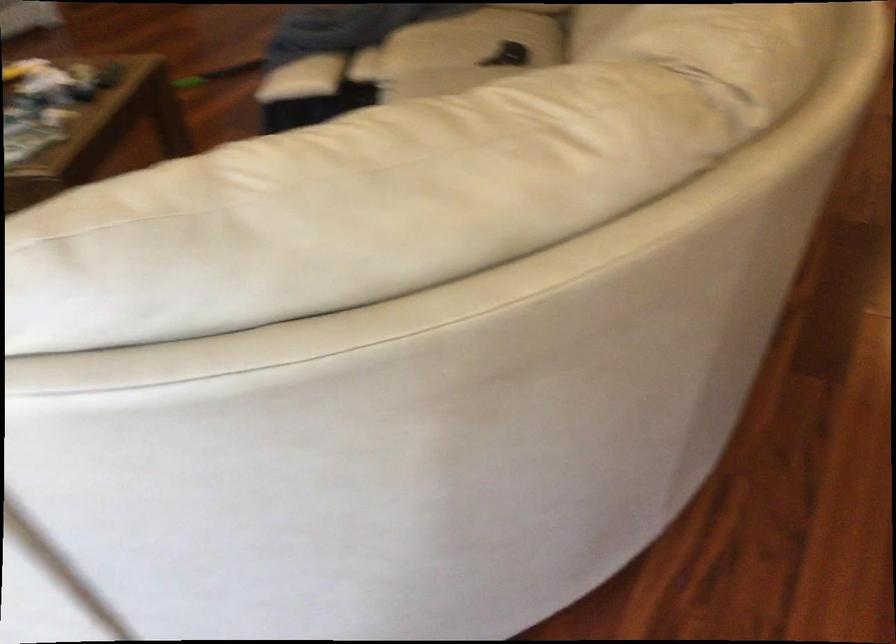
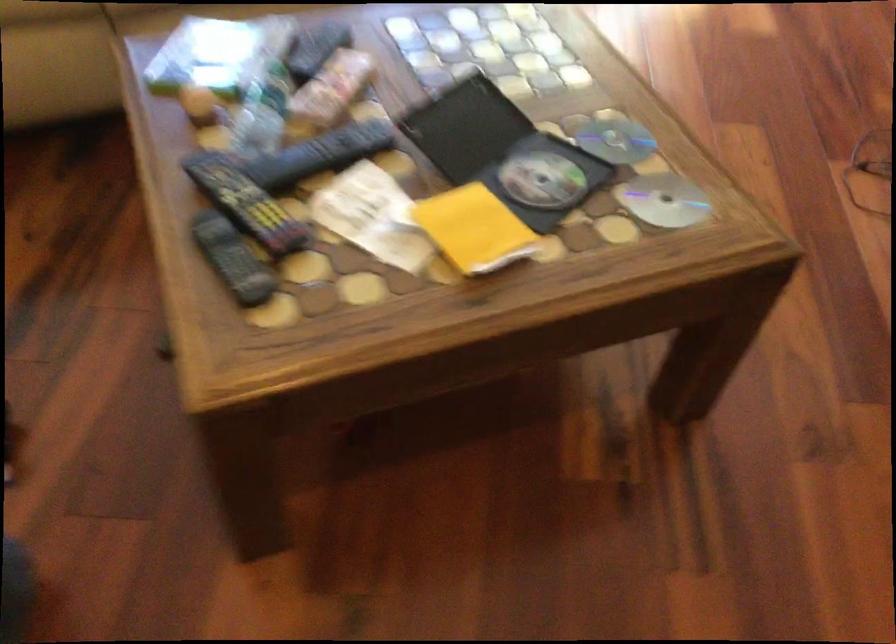
The point at (102, 71) is marked in the first image. Where is the corresponding point in the second image?

(233, 259)